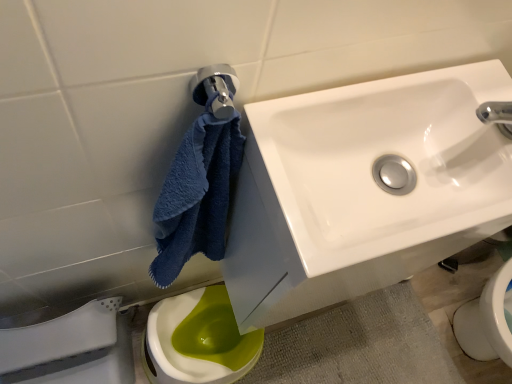
This screenshot has width=512, height=384. Describe the element at coordinates (385, 155) in the screenshot. I see `white glossy sink at upper right` at that location.

Measure the distance between white glossy sink at upper right and camera.

white glossy sink at upper right is 17.20 inches away from camera.

Measure the distance between green glossy toilet at lower left and camera.

green glossy toilet at lower left and camera are 95.00 centimeters apart from each other.

Describe the element at coordinates (71, 348) in the screenshot. This screenshot has width=512, height=384. I see `white glossy porcelain at lower left` at that location.

Where is `white glossy sink at upper right`? This screenshot has width=512, height=384. white glossy sink at upper right is located at coordinates (385, 155).

Is white glossy sink at upper right facing away from white glossy porcelain at lower left?

No, white glossy sink at upper right is not facing away from white glossy porcelain at lower left.

Between white glossy sink at upper right and white glossy porcelain at lower left, which one is positioned in front?

white glossy sink at upper right is more forward.

Does point (314, 174) appear closer or farther from the camera than point (130, 381)?

Point (314, 174) is positioned closer to the camera compared to point (130, 381).

How different are the orientations of white glossy sink at upper right and white glossy porcelain at lower left in degrees?

0.744 degrees separate the facing orientations of white glossy sink at upper right and white glossy porcelain at lower left.

Find the location of a particular element. toilet below the white glossy sink at upper right (from a real-world perspective) is located at coordinates (198, 340).

Consider the image. From the image's perspective, is white glossy sink at upper right under green glossy toilet at lower left?

No, from the image's perspective, white glossy sink at upper right is not below green glossy toilet at lower left.

In the scene shown: Is white glossy sink at upper right bigger than green glossy toilet at lower left?

Incorrect, white glossy sink at upper right is not larger than green glossy toilet at lower left.

Is white glossy sink at upper right looking in the opposite direction of green glossy toilet at lower left?

No, white glossy sink at upper right is not facing away from green glossy toilet at lower left.

Are green glossy toilet at lower left and white glossy porcelain at lower left located far from each other?

Actually, green glossy toilet at lower left and white glossy porcelain at lower left are a little close together.

How many degrees apart are the facing directions of green glossy toilet at lower left and white glossy porcelain at lower left?

0.000864 degrees separate the facing orientations of green glossy toilet at lower left and white glossy porcelain at lower left.

In terms of width, does green glossy toilet at lower left look wider or thinner when compared to white glossy porcelain at lower left?

Clearly, green glossy toilet at lower left has more width compared to white glossy porcelain at lower left.

From a real-world perspective, is green glossy toilet at lower left on white glossy sink at upper right?

Incorrect, from a real-world perspective, green glossy toilet at lower left is lower than white glossy sink at upper right.

From the image's perspective, is green glossy toilet at lower left above or below white glossy sink at upper right?

From the image's perspective, green glossy toilet at lower left appears below white glossy sink at upper right.

Is the position of green glossy toilet at lower left more distant than that of white glossy sink at upper right?

Yes, the depth of green glossy toilet at lower left is greater than that of white glossy sink at upper right.

How distant is green glossy toilet at lower left from white glossy sink at upper right?

green glossy toilet at lower left is 28.39 inches from white glossy sink at upper right.

In terms of size, does white glossy porcelain at lower left appear bigger or smaller than white glossy sink at upper right?

white glossy porcelain at lower left is bigger than white glossy sink at upper right.

Do you think white glossy porcelain at lower left is within white glossy sink at upper right, or outside of it?

white glossy porcelain at lower left is located beyond the bounds of white glossy sink at upper right.

From the picture: Between white glossy porcelain at lower left and white glossy sink at upper right, which one has larger width?

Wider between the two is white glossy sink at upper right.

Which object is positioned more to the left, white glossy porcelain at lower left or white glossy sink at upper right?

From the viewer's perspective, white glossy porcelain at lower left appears more on the left side.

From a real-world perspective, is white glossy porcelain at lower left physically below green glossy toilet at lower left?

No, from a real-world perspective, white glossy porcelain at lower left is not below green glossy toilet at lower left.

Between white glossy porcelain at lower left and green glossy toilet at lower left, which one has smaller width?

Thinner between the two is white glossy porcelain at lower left.

Does white glossy porcelain at lower left have a smaller size compared to green glossy toilet at lower left?

Incorrect, white glossy porcelain at lower left is not smaller in size than green glossy toilet at lower left.

Which is in front, white glossy porcelain at lower left or green glossy toilet at lower left?

white glossy porcelain at lower left.

This screenshot has width=512, height=384. Identify the location of porcelain behind the white glossy sink at upper right. (71, 348).

Locate an element on the screen. The height and width of the screenshot is (384, 512). sink located in front of the green glossy toilet at lower left is located at coordinates (385, 155).

Based on their spatial positions, is green glossy toilet at lower left or white glossy sink at upper right further from white glossy porcelain at lower left?

Among the two, white glossy sink at upper right is located further to white glossy porcelain at lower left.

Which object lies nearer to the anchor point white glossy sink at upper right, white glossy porcelain at lower left or green glossy toilet at lower left?

Among the two, white glossy porcelain at lower left is located nearer to white glossy sink at upper right.

When comparing their distances from green glossy toilet at lower left, does white glossy porcelain at lower left or white glossy sink at upper right seem further?

white glossy sink at upper right is further to green glossy toilet at lower left.

From the picture: Which object lies nearer to the anchor point white glossy sink at upper right, green glossy toilet at lower left or white glossy porcelain at lower left?

The object closer to white glossy sink at upper right is white glossy porcelain at lower left.

From the image, which object appears to be farther from white glossy porcelain at lower left, white glossy sink at upper right or green glossy toilet at lower left?

white glossy sink at upper right lies further to white glossy porcelain at lower left than the other object.

Considering their positions, is white glossy sink at upper right positioned further to green glossy toilet at lower left than white glossy porcelain at lower left?

Among the two, white glossy sink at upper right is located further to green glossy toilet at lower left.

What are the coordinates of `toilet between white glossy porcelain at lower left and white glossy sink at upper right in the horizontal direction` in the screenshot? It's located at (198, 340).